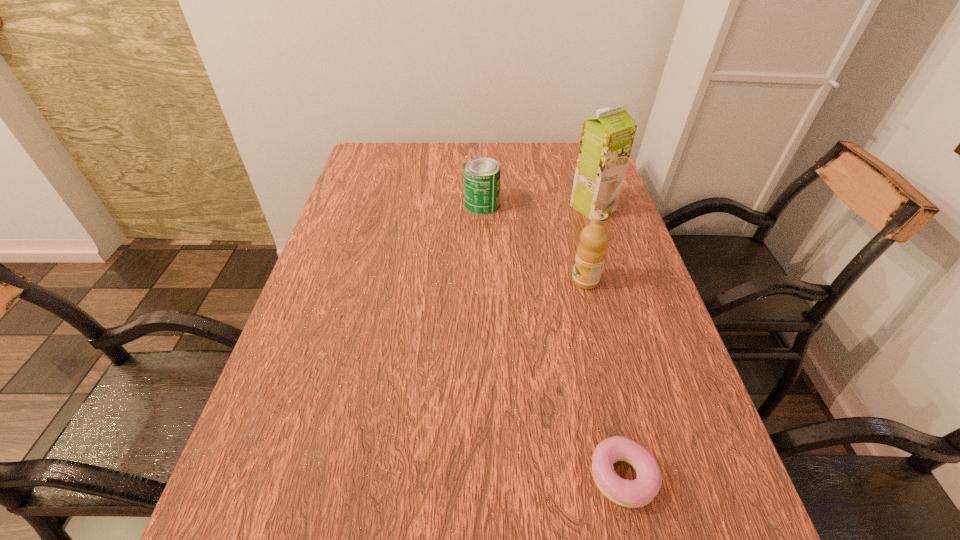
The width and height of the screenshot is (960, 540). What are the coordinates of `the second closest object relative to the olive oil` in the screenshot? It's located at (482, 175).

Locate an element on the screen. free space that satisfies the following two spatial constraints: 1. on the label of the second tallest object; 2. on the front side of the doughnut is located at coordinates (633, 476).

The width and height of the screenshot is (960, 540). Find the location of `vacant area in the image that satisfies the following two spatial constraints: 1. on the label of the olive oil; 2. on the front side of the shortest object`. vacant area in the image that satisfies the following two spatial constraints: 1. on the label of the olive oil; 2. on the front side of the shortest object is located at coordinates (633, 476).